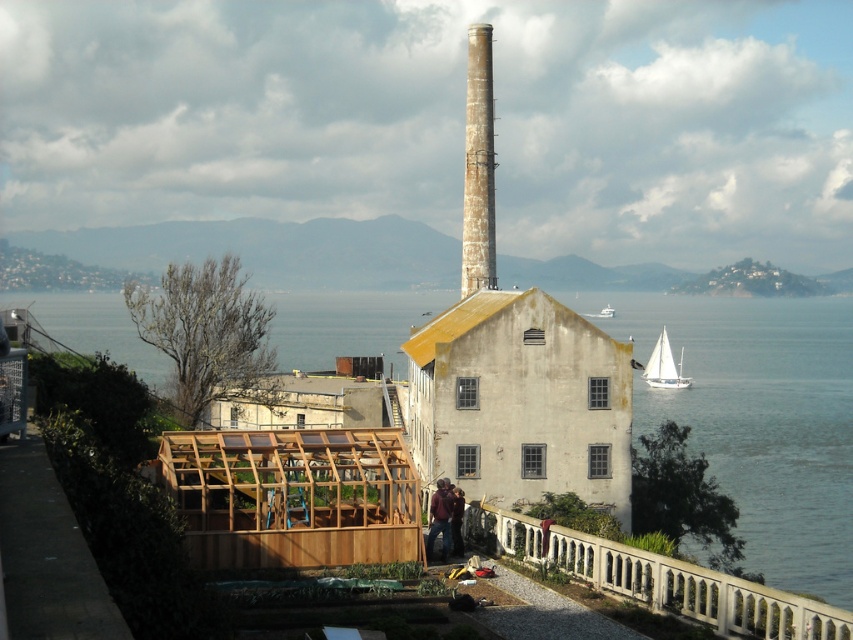
Question: Which of the following is the farthest from the observer?

Choices:
 (A) white stone railing at lower right
 (B) natural wood greenhouse at lower left
 (C) transparent glass water at center
 (D) rusty metal chimney at center

Answer: (D)

Question: Does transparent glass water at center appear on the right side of natural wood greenhouse at lower left?

Choices:
 (A) no
 (B) yes

Answer: (B)

Question: Is natural wood greenhouse at lower left below rusty metal chimney at center?

Choices:
 (A) no
 (B) yes

Answer: (B)

Question: Which point appears closest to the camera in this image?

Choices:
 (A) (614, 579)
 (B) (672, 378)
 (C) (601, 310)

Answer: (A)

Question: Which object is positioned farthest from the transparent glass water at center?

Choices:
 (A) dark brown leather jacket at center
 (B) white sailboat at right

Answer: (A)

Question: Does natural wood greenhouse at lower left have a lesser width compared to brown leather jacket at center?

Choices:
 (A) yes
 (B) no

Answer: (B)